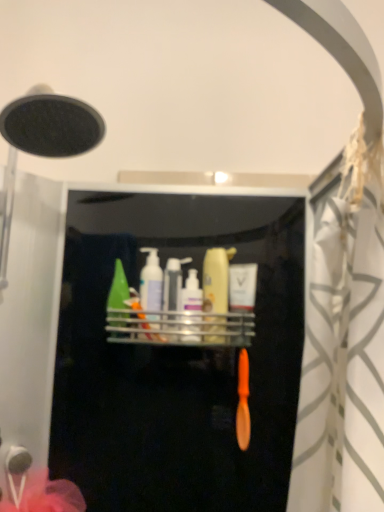
Question: Is white matte pump bottle at center, positioned as the 2th toiletry in left-to-right order, completely or partially inside matte white lotion at center, the 5th toiletry positioned from the left?

Choices:
 (A) yes
 (B) no

Answer: (B)

Question: Is white matte pump bottle at center, positioned as the fourth toiletry in right-to-left order, at the back of matte white lotion at center, which is counted as the first toiletry, starting from the right?

Choices:
 (A) yes
 (B) no

Answer: (B)

Question: Can you confirm if matte white lotion at center, the 5th toiletry positioned from the left, is shorter than white matte pump bottle at center, positioned as the 2th toiletry in left-to-right order?

Choices:
 (A) yes
 (B) no

Answer: (A)

Question: From the image's perspective, is matte white lotion at center, the 5th toiletry positioned from the left, above white matte pump bottle at center, positioned as the 2th toiletry in left-to-right order?

Choices:
 (A) yes
 (B) no

Answer: (B)

Question: Does matte white lotion at center, which is counted as the first toiletry, starting from the right, come behind white matte pump bottle at center, positioned as the fourth toiletry in right-to-left order?

Choices:
 (A) yes
 (B) no

Answer: (A)

Question: From the image's perspective, is matte white lotion at center, which is counted as the first toiletry, starting from the right, beneath white matte pump bottle at center, positioned as the fourth toiletry in right-to-left order?

Choices:
 (A) no
 (B) yes

Answer: (B)

Question: Is translucent plastic bottle at center, arranged as the 3th toiletry when viewed from the right, not near green matte bottle at center, the 5th toiletry from the right?

Choices:
 (A) no
 (B) yes

Answer: (A)

Question: Is the depth of translucent plastic bottle at center, arranged as the 3th toiletry when viewed from the right, less than that of green matte bottle at center, the 5th toiletry from the right?

Choices:
 (A) no
 (B) yes

Answer: (B)

Question: Considering the relative sizes of translucent plastic bottle at center, arranged as the 3th toiletry when viewed from the right, and green matte bottle at center, the first toiletry from the left, in the image provided, is translucent plastic bottle at center, arranged as the 3th toiletry when viewed from the right, bigger than green matte bottle at center, the first toiletry from the left,?

Choices:
 (A) yes
 (B) no

Answer: (B)

Question: Can you confirm if translucent plastic bottle at center, placed as the 3th toiletry when sorted from left to right, is smaller than green matte bottle at center, the first toiletry from the left?

Choices:
 (A) yes
 (B) no

Answer: (A)

Question: From the image's perspective, is translucent plastic bottle at center, placed as the 3th toiletry when sorted from left to right, located above green matte bottle at center, the 5th toiletry from the right?

Choices:
 (A) yes
 (B) no

Answer: (B)

Question: Is translucent plastic bottle at center, arranged as the 3th toiletry when viewed from the right, outside of green matte bottle at center, the 5th toiletry from the right?

Choices:
 (A) no
 (B) yes

Answer: (B)

Question: Does matte yellow bottle at center, which is the 2th toiletry from right to left, have a larger size compared to green matte bottle at center, the first toiletry from the left?

Choices:
 (A) yes
 (B) no

Answer: (A)